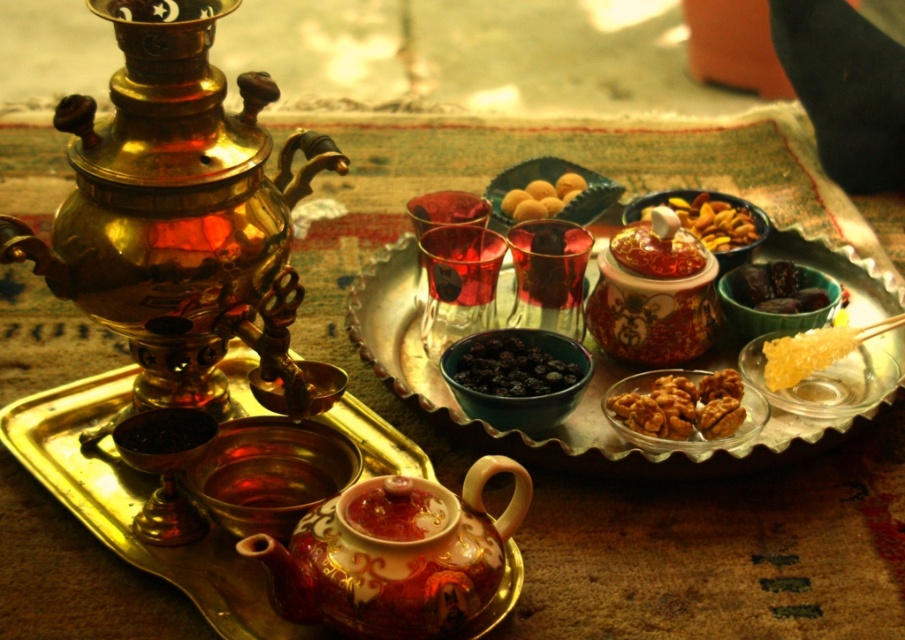
What do you see at coordinates (269, 483) in the screenshot? I see `shiny glass teacup at center` at bounding box center [269, 483].

Which is in front, point (291, 481) or point (796, 333)?

Point (291, 481)

Locate an element on the screen. shiny glass teacup at center is located at coordinates point(269,483).

Is shiny ceramic teapot at center smaller than smooth golden nuts at center?

Actually, shiny ceramic teapot at center might be larger than smooth golden nuts at center.

Can you confirm if shiny ceramic teapot at center is positioned below smooth golden nuts at center?

Yes, shiny ceramic teapot at center is below smooth golden nuts at center.

The image size is (905, 640). I want to click on shiny ceramic teapot at center, so click(394, 556).

The width and height of the screenshot is (905, 640). Identify the location of shiny ceramic teapot at center. [x=394, y=556].

Is red glossy teapot at center to the right of shiny brown nuts at center from the viewer's perspective?

Incorrect, red glossy teapot at center is not on the right side of shiny brown nuts at center.

Is red glossy teapot at center wider than shiny brown nuts at center?

Yes.

Who is more forward, (702, 324) or (637, 392)?

Positioned in front is point (637, 392).

Image resolution: width=905 pixels, height=640 pixels. I want to click on red glossy teapot at center, so click(654, 292).